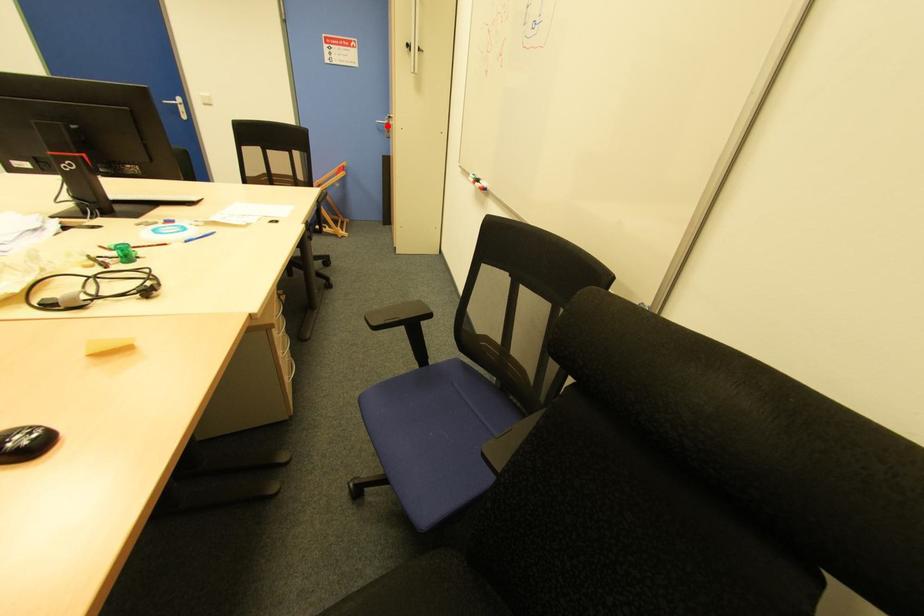
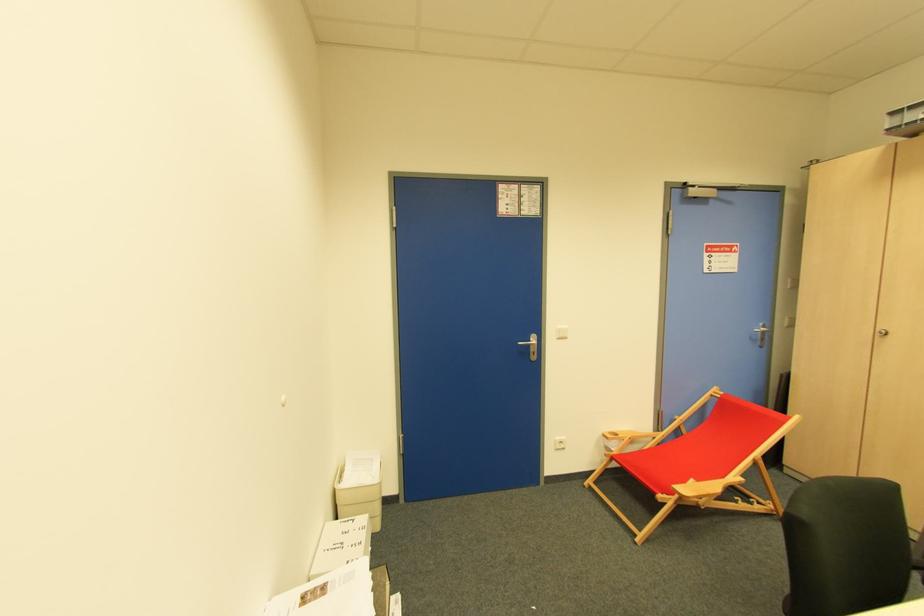
Question: I am providing you with two images of the same scene from different viewpoints. Given a red point in image1, look at the same physical point in image2. Is it:

Choices:
 (A) Closer to the viewpoint
 (B) Farther from the viewpoint

Answer: (B)